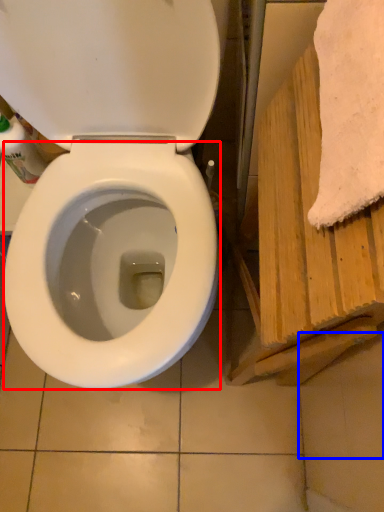
Question: Which point is further to the camera, bidet (highlighted by a red box) or tile (highlighted by a blue box)?

Choices:
 (A) bidet
 (B) tile

Answer: (B)